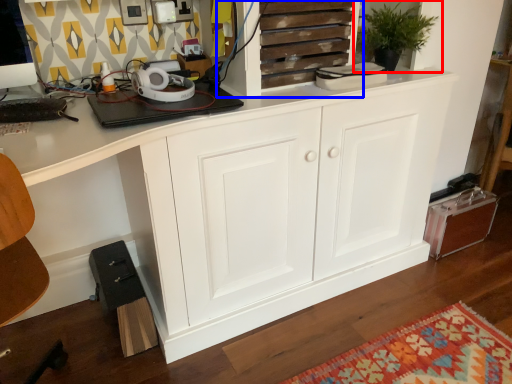
Question: Which object appears farthest to the camera in this image, houseplant (highlighted by a red box) or cupboard (highlighted by a blue box)?

Choices:
 (A) houseplant
 (B) cupboard

Answer: (A)